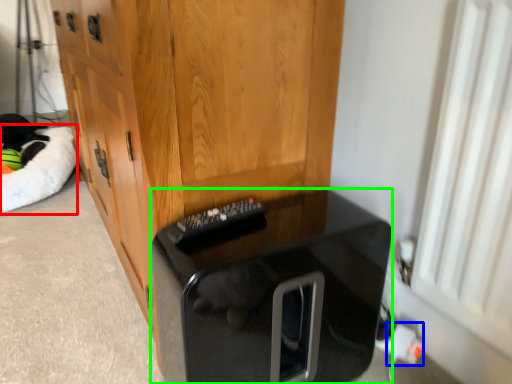
Question: Which is nearer to the cat bed (highlighted by a red box)? electric outlet (highlighted by a blue box) or furniture (highlighted by a green box).

Choices:
 (A) electric outlet
 (B) furniture

Answer: (B)